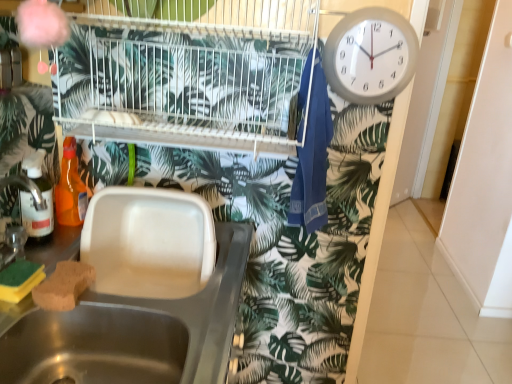
Question: In terms of size, does blue fabric laundry at upper right appear bigger or smaller than white plastic clock at upper right?

Choices:
 (A) small
 (B) big

Answer: (B)

Question: Based on their positions, is blue fabric laundry at upper right located to the left or right of white plastic clock at upper right?

Choices:
 (A) right
 (B) left

Answer: (B)

Question: Which object is the farthest from the green sponge at lower left, the first food when ordered from left to right?

Choices:
 (A) translucent plastic bottle at left, the first bottle viewed from the front
 (B) white plastic clock at upper right
 (C) white wire bird cage at upper center
 (D) translucent orange bottle at left, which is the 2th bottle in front-to-back order
 (E) blue fabric laundry at upper right

Answer: (B)

Question: Estimate the real-world distances between objects in this image. Which object is farther from the white plastic clock at upper right?

Choices:
 (A) white plastic sink at lower left
 (B) white wire bird cage at upper center
 (C) blue fabric laundry at upper right
 (D) brown sponge at sink left, which ranks as the 2th food in left-to-right order
 (E) translucent plastic bottle at left, the first bottle viewed from the front

Answer: (D)